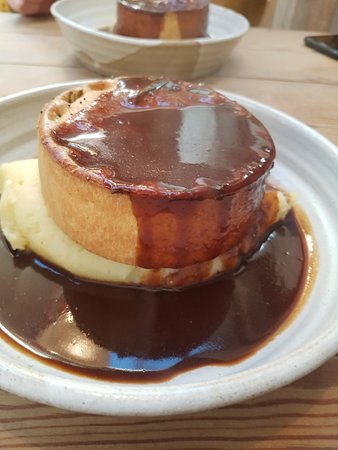
The width and height of the screenshot is (338, 450). I want to click on white plate, so click(180, 401).